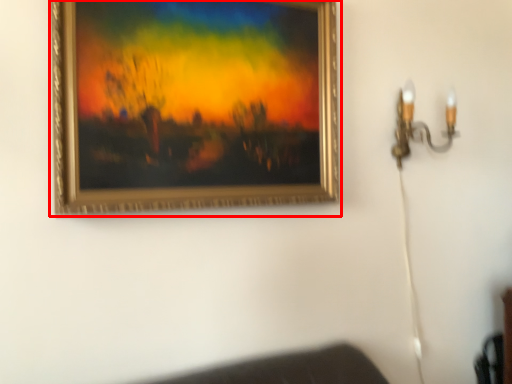
Question: From the image's perspective, where is picture frame (annotated by the red box) located relative to lamp?

Choices:
 (A) below
 (B) above

Answer: (B)